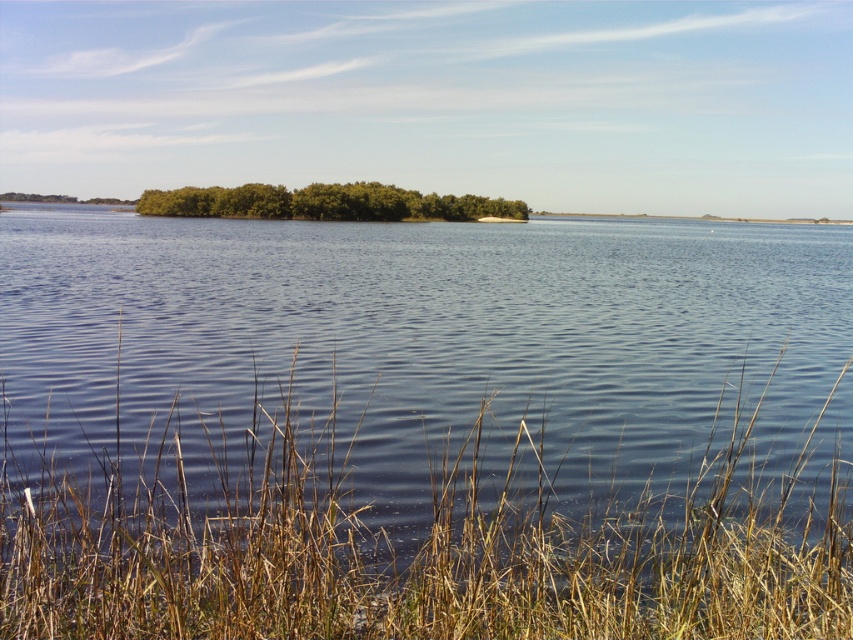
You are standing at the edge of the water and see the dry grass at lower center and the green leafy trees at center. Which object is narrower in width?

The dry grass at lower center has a lesser width compared to the green leafy trees at center, so the dry grass at lower center is narrower in width.

From the picture: You are standing at the edge of the lake and see the dry grass at lower center and the green leafy trees at center. Which object is closer to you?

The dry grass at lower center is closer to you because it is positioned below the green leafy trees at center, indicating it is in the foreground.